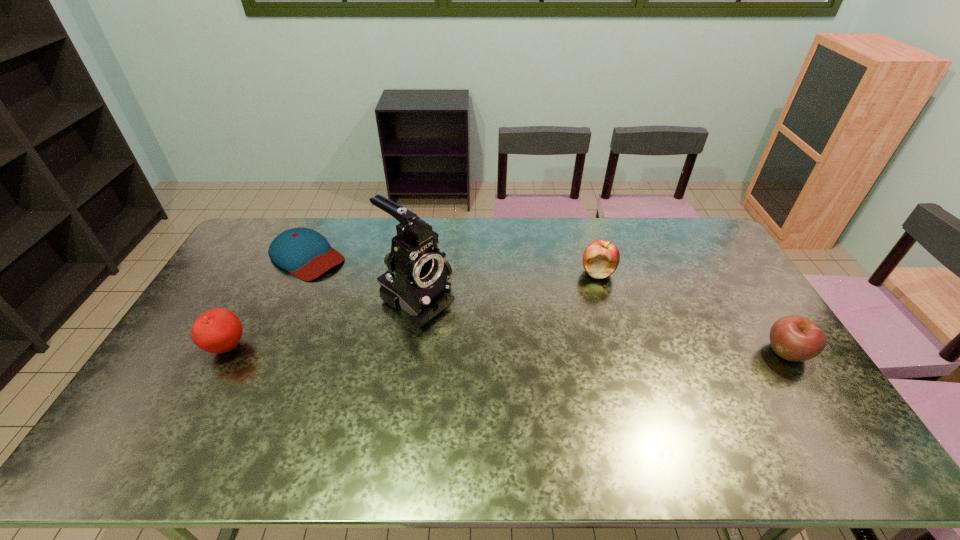
Image resolution: width=960 pixels, height=540 pixels. What are the coordinates of `apple located in the left edge section of the desktop` in the screenshot? It's located at (218, 330).

Locate an element on the screen. baseball cap at the left edge is located at coordinates (305, 253).

Identify the location of object situated at the right edge. The width and height of the screenshot is (960, 540). (795, 338).

At what (x,y) coordinates should I click in order to perform the action: click on object located at the far left corner. Please return your answer as a coordinate pair (x, y). Looking at the image, I should click on (305, 253).

In the image, there is a desktop. At what (x,y) coordinates should I click in order to perform the action: click on vacant space at the far edge. Please return your answer as a coordinate pair (x, y). This screenshot has height=540, width=960. Looking at the image, I should click on (612, 222).

Where is `free space at the near edge of the desktop`? free space at the near edge of the desktop is located at coordinates (367, 416).

You are a GUI agent. You are given a task and a screenshot of the screen. Output one action in this format:
    pyautogui.click(x=<x>, y=<y>)
    Task: Click on the vacant area at the left edge
    The image size is (960, 540).
    Given the screenshot: What is the action you would take?
    pyautogui.click(x=257, y=258)

At what (x,y) coordinates should I click in order to perform the action: click on free region at the right edge. Please return your answer as a coordinate pair (x, y). Image resolution: width=960 pixels, height=540 pixels. Looking at the image, I should click on (768, 328).

In the image, there is a desktop. In order to click on vacant space at the far right corner in this screenshot , I will do `click(712, 243)`.

This screenshot has width=960, height=540. In order to click on vacant region between the rightmost apple and the leftmost apple in this screenshot , I will do click(x=508, y=350).